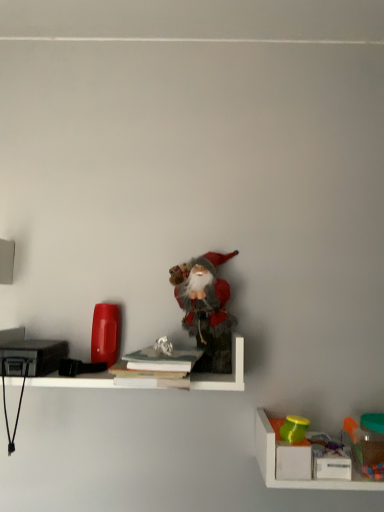
This screenshot has height=512, width=384. What do you see at coordinates (148, 377) in the screenshot? I see `hardcover book at center, which ranks as the second book in top-to-bottom order` at bounding box center [148, 377].

At what (x,y) coordinates should I click in order to perform the action: click on white matte shelf at center, the second shelf ordered from the bottom. Please return your answer as a coordinate pair (x, y). The width and height of the screenshot is (384, 512). Looking at the image, I should click on (156, 378).

In order to click on white paper at center, which ranks as the second book in bottom-to-top order in this screenshot , I will do `click(162, 359)`.

The image size is (384, 512). Describe the element at coordinates (162, 359) in the screenshot. I see `white paper at center, the 1th book positioned from the top` at that location.

Describe the element at coordinates (294, 429) in the screenshot. I see `matte green cup at lower right, placed as the 2th toy when sorted from bottom to top` at that location.

What is the approximate height of fuzzy fabric santa at center, the first toy from the left?

12.02 inches.

Image resolution: width=384 pixels, height=512 pixels. Identify the location of fuzzy fabric santa at center, arranged as the 1th toy when viewed from the top. (206, 309).

The height and width of the screenshot is (512, 384). Identify the location of hardcover book at center, the 1th book positioned from the bottom. (148, 377).

What's the angular difference between white paper at center, which ranks as the second book in bottom-to-top order, and matte green cup at lower right, placed as the second toy when sorted from right to left,'s facing directions?

white paper at center, which ranks as the second book in bottom-to-top order, and matte green cup at lower right, placed as the second toy when sorted from right to left, are facing 2.17 degrees away from each other.

Is white paper at center, the 1th book positioned from the top, oriented away from matte green cup at lower right, positioned as the 2th toy in top-to-bottom order?

white paper at center, the 1th book positioned from the top, does not have its back to matte green cup at lower right, positioned as the 2th toy in top-to-bottom order.

Which is correct: white paper at center, the 1th book positioned from the top, is inside matte green cup at lower right, positioned as the 2th toy in top-to-bottom order, or outside of it?

white paper at center, the 1th book positioned from the top, is outside matte green cup at lower right, positioned as the 2th toy in top-to-bottom order.

Starting from the matte green cup at lower right, positioned as the 2th toy in top-to-bottom order, which book is the 2nd one in front? Please provide its 2D coordinates.

[(162, 359)]

In order to click on the 2nd shelf positioned below the white paper at center, the 1th book positioned from the top (from a real-world perspective) in this screenshot , I will do `click(294, 480)`.

Which of these two, white paper at center, the 1th book positioned from the top, or translucent plastic container at lower right, the 1th shelf when ordered from bottom to top, is bigger?

translucent plastic container at lower right, the 1th shelf when ordered from bottom to top, is bigger.

Is white paper at center, which ranks as the second book in bottom-to-top order, beside translucent plastic container at lower right, the 1th shelf positioned from the right?

No, white paper at center, which ranks as the second book in bottom-to-top order, is not touching translucent plastic container at lower right, the 1th shelf positioned from the right.

Considering the relative sizes of white paper at center, the 1th book positioned from the top, and translucent plastic container at lower right, the second shelf viewed from the left, in the image provided, is white paper at center, the 1th book positioned from the top, wider than translucent plastic container at lower right, the second shelf viewed from the left,?

Yes, white paper at center, the 1th book positioned from the top, is wider than translucent plastic container at lower right, the second shelf viewed from the left.

Is the position of hardcover book at center, which ranks as the second book in top-to-bottom order, less distant than that of translucent plastic container at lower right, marked as the third toy in a top-to-bottom arrangement?

Yes, hardcover book at center, which ranks as the second book in top-to-bottom order, is closer to the viewer.

Which object is positioned more to the right, hardcover book at center, which ranks as the second book in top-to-bottom order, or translucent plastic container at lower right, acting as the first toy starting from the right?

translucent plastic container at lower right, acting as the first toy starting from the right.

Would you say hardcover book at center, the 1th book positioned from the bottom, is a long distance from translucent plastic container at lower right, which is the 1th toy in bottom-to-top order?

hardcover book at center, the 1th book positioned from the bottom, is actually quite close to translucent plastic container at lower right, which is the 1th toy in bottom-to-top order.

Could you tell me if translucent plastic container at lower right, the second shelf viewed from the left, is facing white matte shelf at center, which is the second shelf in right-to-left order?

No, translucent plastic container at lower right, the second shelf viewed from the left, is not aimed at white matte shelf at center, which is the second shelf in right-to-left order.

Considering the relative sizes of translucent plastic container at lower right, the second shelf viewed from the top, and white matte shelf at center, the second shelf ordered from the bottom, in the image provided, is translucent plastic container at lower right, the second shelf viewed from the top, wider than white matte shelf at center, the second shelf ordered from the bottom,?

In fact, translucent plastic container at lower right, the second shelf viewed from the top, might be narrower than white matte shelf at center, the second shelf ordered from the bottom.

Which of these two, translucent plastic container at lower right, the second shelf viewed from the top, or white matte shelf at center, positioned as the first shelf in top-to-bottom order, is bigger?

white matte shelf at center, positioned as the first shelf in top-to-bottom order, is bigger.

How many degrees apart are the facing directions of translucent plastic container at lower right, which is the 1th toy in bottom-to-top order, and translucent plastic container at lower right, the second shelf viewed from the top?

The facing directions of translucent plastic container at lower right, which is the 1th toy in bottom-to-top order, and translucent plastic container at lower right, the second shelf viewed from the top, are 0.00282 degrees apart.

Is the depth of translucent plastic container at lower right, positioned as the 3th toy in left-to-right order, greater than that of translucent plastic container at lower right, the second shelf viewed from the top?

Yes, translucent plastic container at lower right, positioned as the 3th toy in left-to-right order, is behind translucent plastic container at lower right, the second shelf viewed from the top.

From a real-world perspective, which object rests below the other?

translucent plastic container at lower right, the second shelf viewed from the top, from a real-world perspective.

From the picture: Considering the positions of objects translucent plastic container at lower right, marked as the third toy in a top-to-bottom arrangement, and translucent plastic container at lower right, the second shelf viewed from the left, in the image provided, who is more to the right, translucent plastic container at lower right, marked as the third toy in a top-to-bottom arrangement, or translucent plastic container at lower right, the second shelf viewed from the left,?

translucent plastic container at lower right, marked as the third toy in a top-to-bottom arrangement.

Between fuzzy fabric santa at center, arranged as the 1th toy when viewed from the top, and matte green cup at lower right, positioned as the 2th toy in top-to-bottom order, which one has smaller size?

matte green cup at lower right, positioned as the 2th toy in top-to-bottom order, is smaller.

From a real-world perspective, which object rests below the other?

matte green cup at lower right, positioned as the 2th toy in top-to-bottom order, is physically lower.

Measure the distance from fuzzy fabric santa at center, the first toy from the left, to matte green cup at lower right, placed as the 2th toy when sorted from bottom to top.

The distance of fuzzy fabric santa at center, the first toy from the left, from matte green cup at lower right, placed as the 2th toy when sorted from bottom to top, is 12.40 inches.

Looking at their sizes, would you say fuzzy fabric santa at center, arranged as the 1th toy when viewed from the top, is wider or thinner than matte green cup at lower right, which is the 2th toy in left-to-right order?

Considering their sizes, fuzzy fabric santa at center, arranged as the 1th toy when viewed from the top, looks broader than matte green cup at lower right, which is the 2th toy in left-to-right order.

Is point (291, 420) behind point (277, 485)?

Yes, point (291, 420) is farther from viewer.

Identify the location of the 2nd toy above the translucent plastic container at lower right, the second shelf viewed from the top (from the image's perspective). (294, 429).

Is matte green cup at lower right, positioned as the 2th toy in top-to-bottom order, facing towards translucent plastic container at lower right, the second shelf viewed from the left?

Yes, matte green cup at lower right, positioned as the 2th toy in top-to-bottom order, is facing translucent plastic container at lower right, the second shelf viewed from the left.

Which object is further away from the camera, matte green cup at lower right, placed as the 2th toy when sorted from bottom to top, or translucent plastic container at lower right, the second shelf viewed from the left?

matte green cup at lower right, placed as the 2th toy when sorted from bottom to top, is further away from the camera.

What are the coordinates of `the 2nd toy behind the white paper at center, the 1th book positioned from the top, starting your count from the anchor` in the screenshot? It's located at (294, 429).

From the image's perspective, starting from the white paper at center, which ranks as the second book in bottom-to-top order, which shelf is the 2nd one below? Please provide its 2D coordinates.

[(294, 480)]

Considering their positions, is white matte shelf at center, positioned as the first shelf in top-to-bottom order, positioned closer to fuzzy fabric santa at center, arranged as the 1th toy when viewed from the top, than white paper at center, the 1th book positioned from the top?

Among the two, white paper at center, the 1th book positioned from the top, is located nearer to fuzzy fabric santa at center, arranged as the 1th toy when viewed from the top.

In the scene shown: Looking at the image, which one is located further to fuzzy fabric santa at center, the third toy from the bottom, hardcover book at center, which ranks as the second book in top-to-bottom order, or white paper at center, the 1th book positioned from the top?

The object further to fuzzy fabric santa at center, the third toy from the bottom, is hardcover book at center, which ranks as the second book in top-to-bottom order.

Based on their spatial positions, is translucent plastic container at lower right, the second shelf viewed from the left, or white matte shelf at center, positioned as the first shelf in top-to-bottom order, further from matte green cup at lower right, placed as the second toy when sorted from right to left?

white matte shelf at center, positioned as the first shelf in top-to-bottom order, is positioned further to the anchor matte green cup at lower right, placed as the second toy when sorted from right to left.

Looking at the image, which one is located closer to matte green cup at lower right, which is the 2th toy in left-to-right order, white matte shelf at center, which is the second shelf in right-to-left order, or fuzzy fabric santa at center, arranged as the 1th toy when viewed from the top?

Based on the image, white matte shelf at center, which is the second shelf in right-to-left order, appears to be nearer to matte green cup at lower right, which is the 2th toy in left-to-right order.

Which object lies further to the anchor point white paper at center, which ranks as the second book in bottom-to-top order, translucent plastic container at lower right, the 1th shelf when ordered from bottom to top, or fuzzy fabric santa at center, arranged as the third toy when viewed from the right?

Based on the image, translucent plastic container at lower right, the 1th shelf when ordered from bottom to top, appears to be further to white paper at center, which ranks as the second book in bottom-to-top order.

Considering their positions, is translucent plastic container at lower right, marked as the third toy in a top-to-bottom arrangement, positioned closer to white matte shelf at center, positioned as the first shelf in top-to-bottom order, than hardcover book at center, which ranks as the second book in top-to-bottom order?

hardcover book at center, which ranks as the second book in top-to-bottom order, is positioned closer to the anchor white matte shelf at center, positioned as the first shelf in top-to-bottom order.

Consider the image. Looking at the image, which one is located closer to fuzzy fabric santa at center, the third toy from the bottom, translucent plastic container at lower right, the 1th shelf positioned from the right, or matte green cup at lower right, placed as the second toy when sorted from right to left?

Based on the image, translucent plastic container at lower right, the 1th shelf positioned from the right, appears to be nearer to fuzzy fabric santa at center, the third toy from the bottom.

From the image, which object appears to be farther from white matte shelf at center, the second shelf ordered from the bottom, translucent plastic container at lower right, the second shelf viewed from the left, or matte green cup at lower right, placed as the 2th toy when sorted from bottom to top?

Among the two, matte green cup at lower right, placed as the 2th toy when sorted from bottom to top, is located further to white matte shelf at center, the second shelf ordered from the bottom.

Locate an element on the screen. This screenshot has height=512, width=384. book between white matte shelf at center, which is the second shelf in right-to-left order, and white paper at center, the 1th book positioned from the top is located at coordinates (148, 377).

Image resolution: width=384 pixels, height=512 pixels. I want to click on toy located between white paper at center, the 1th book positioned from the top, and matte green cup at lower right, placed as the second toy when sorted from right to left, in the left-right direction, so click(x=206, y=309).

Locate an element on the screen. shelf situated between matte green cup at lower right, which is the 2th toy in left-to-right order, and translucent plastic container at lower right, acting as the first toy starting from the right, from left to right is located at coordinates (294, 480).

The height and width of the screenshot is (512, 384). What are the coordinates of `shelf situated between white paper at center, which ranks as the second book in bottom-to-top order, and translucent plastic container at lower right, which is the 1th toy in bottom-to-top order, from left to right` in the screenshot? It's located at (294, 480).